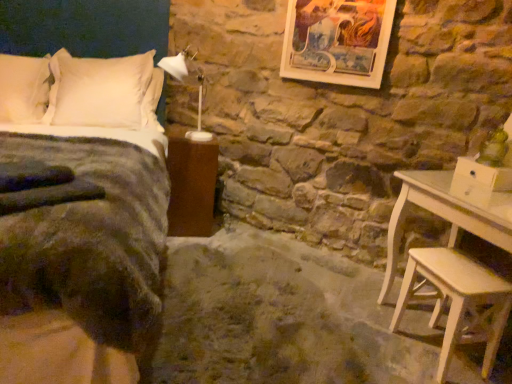
Question: Should I look upward or downward to see white soft pillow at upper left, the 1th pillow from the left?

Choices:
 (A) down
 (B) up

Answer: (B)

Question: Can you confirm if white soft pillow at upper left, the 1th pillow from the left, is smaller than light wood stool at lower right?

Choices:
 (A) yes
 (B) no

Answer: (B)

Question: Is white soft pillow at upper left, the second pillow when ordered from right to left, not inside light wood stool at lower right?

Choices:
 (A) yes
 (B) no

Answer: (A)

Question: Could you tell me if white soft pillow at upper left, the 1th pillow from the left, is facing light wood stool at lower right?

Choices:
 (A) yes
 (B) no

Answer: (B)

Question: Is white soft pillow at upper left, the second pillow when ordered from right to left, at the left side of light wood stool at lower right?

Choices:
 (A) yes
 (B) no

Answer: (A)

Question: From the image's perspective, is white soft pillow at upper left, the 1th pillow from the left, above light wood stool at lower right?

Choices:
 (A) yes
 (B) no

Answer: (A)

Question: Considering the relative sizes of white soft pillow at upper left, the 1th pillow from the left, and light wood stool at lower right in the image provided, is white soft pillow at upper left, the 1th pillow from the left, shorter than light wood stool at lower right?

Choices:
 (A) yes
 (B) no

Answer: (B)

Question: Is white soft pillow at upper left, the 1th pillow from the left, outside of wooden framed artwork at upper center?

Choices:
 (A) no
 (B) yes

Answer: (B)

Question: Is white soft pillow at upper left, the second pillow when ordered from right to left, to the left of wooden framed artwork at upper center from the viewer's perspective?

Choices:
 (A) no
 (B) yes

Answer: (B)

Question: Considering the relative sizes of white soft pillow at upper left, the second pillow when ordered from right to left, and wooden framed artwork at upper center in the image provided, is white soft pillow at upper left, the second pillow when ordered from right to left, thinner than wooden framed artwork at upper center?

Choices:
 (A) no
 (B) yes

Answer: (A)

Question: Can you confirm if white soft pillow at upper left, the 1th pillow from the left, is shorter than wooden framed artwork at upper center?

Choices:
 (A) no
 (B) yes

Answer: (A)

Question: Is white soft pillow at upper left, the second pillow when ordered from right to left, far from wooden framed artwork at upper center?

Choices:
 (A) yes
 (B) no

Answer: (A)

Question: Considering the relative sizes of white soft pillow at upper left, the second pillow when ordered from right to left, and wooden framed artwork at upper center in the image provided, is white soft pillow at upper left, the second pillow when ordered from right to left, wider than wooden framed artwork at upper center?

Choices:
 (A) no
 (B) yes

Answer: (B)

Question: Is velvet dark green bed at left placed right next to white plastic lamp at upper center?

Choices:
 (A) no
 (B) yes

Answer: (A)